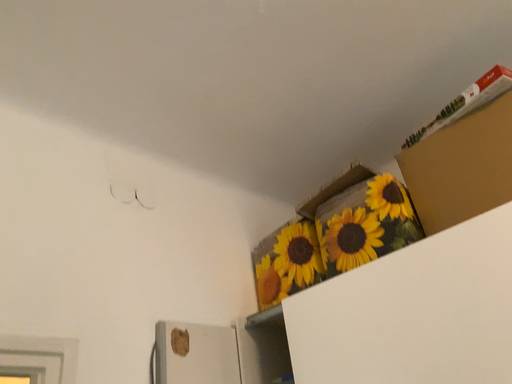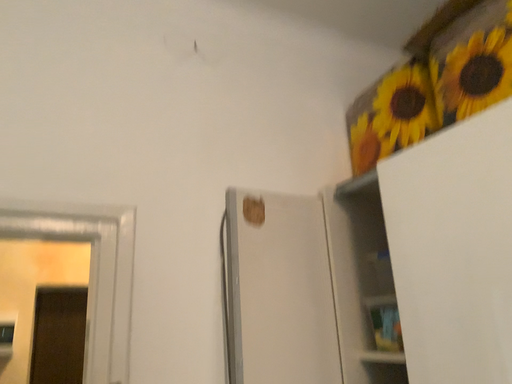
Question: Which way did the camera rotate in the video?

Choices:
 (A) rotated upward
 (B) rotated downward

Answer: (B)